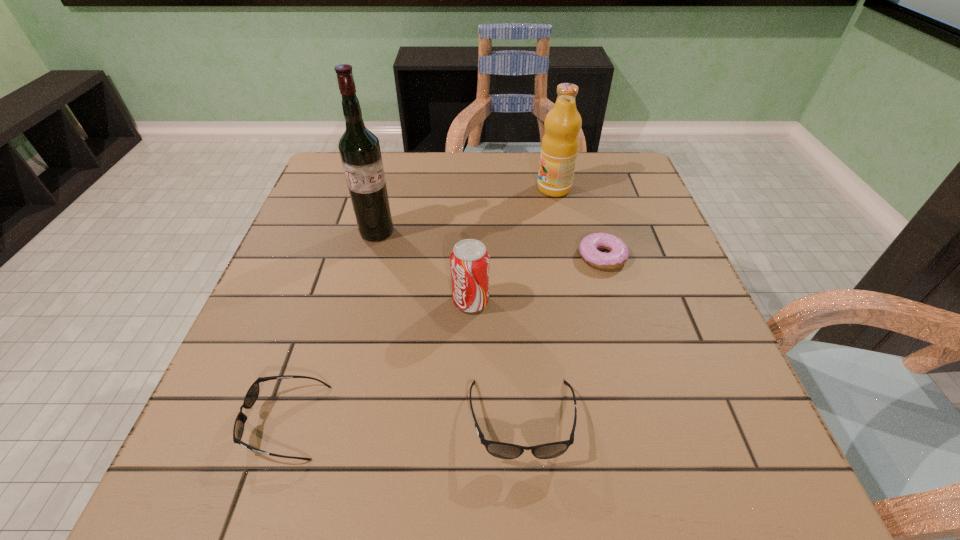
I want to click on free space located 0.310m on the front and back of the tallest object, so click(x=346, y=350).

Image resolution: width=960 pixels, height=540 pixels. I want to click on vacant space positioned 0.350m on the front label of the fruit juice, so [x=410, y=188].

The image size is (960, 540). Identify the location of free space located on the front label of the fruit juice. (518, 188).

Where is `free space located on the front label of the fruit juice`? The width and height of the screenshot is (960, 540). free space located on the front label of the fruit juice is located at coordinates (475, 188).

The width and height of the screenshot is (960, 540). I want to click on vacant region located 0.330m on the logo side of the soda can, so click(647, 301).

Where is `vacant region located on the back of the shortest object`? The height and width of the screenshot is (540, 960). vacant region located on the back of the shortest object is located at coordinates (586, 199).

Find the location of a particular element. This screenshot has height=540, width=960. object positioned at the far edge is located at coordinates (560, 143).

I want to click on sunglasses located in the left edge section of the desktop, so click(252, 394).

You are a GUI agent. You are given a task and a screenshot of the screen. Output one action in this format:
    pyautogui.click(x=<x>, y=<y>)
    Task: Click on the wine bottle present at the left edge
    The image size is (960, 540).
    Given the screenshot: What is the action you would take?
    pyautogui.click(x=359, y=148)

Locate an element on the screen. object positioned at the right edge is located at coordinates (618, 254).